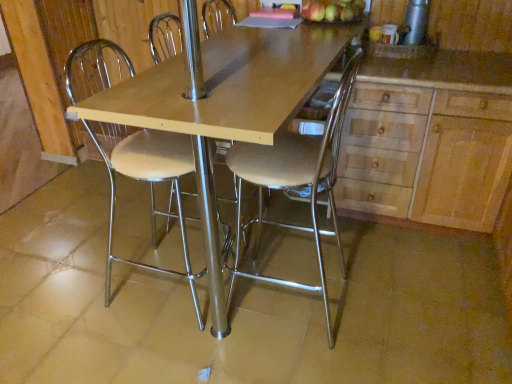
This screenshot has width=512, height=384. Find the location of `vacant space to the right of metallic silver chair at center, which is the 2th chair in left-to-right order`. vacant space to the right of metallic silver chair at center, which is the 2th chair in left-to-right order is located at coordinates (392, 315).